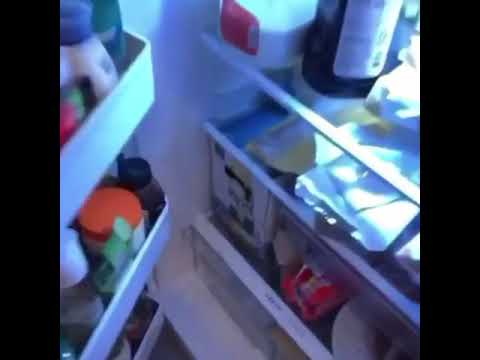
I want to click on bottle, so click(100, 66).